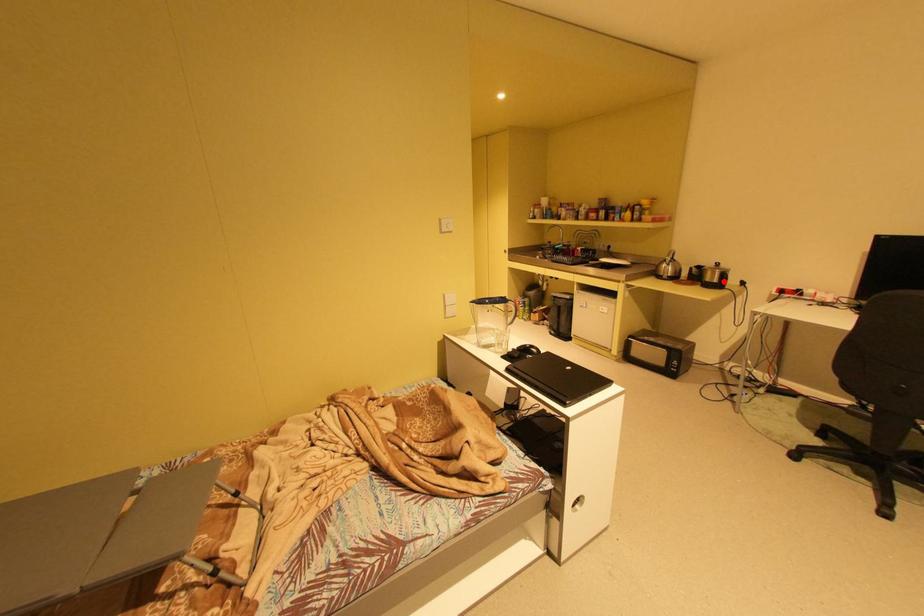
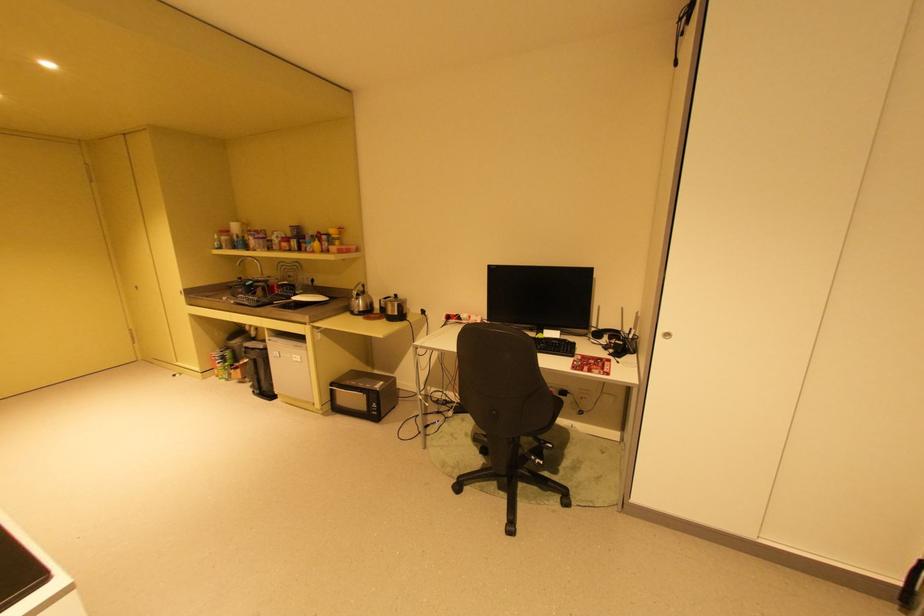
Locate, in the second image, the point that corresponds to the highlighted location in the first image.

(404, 314)